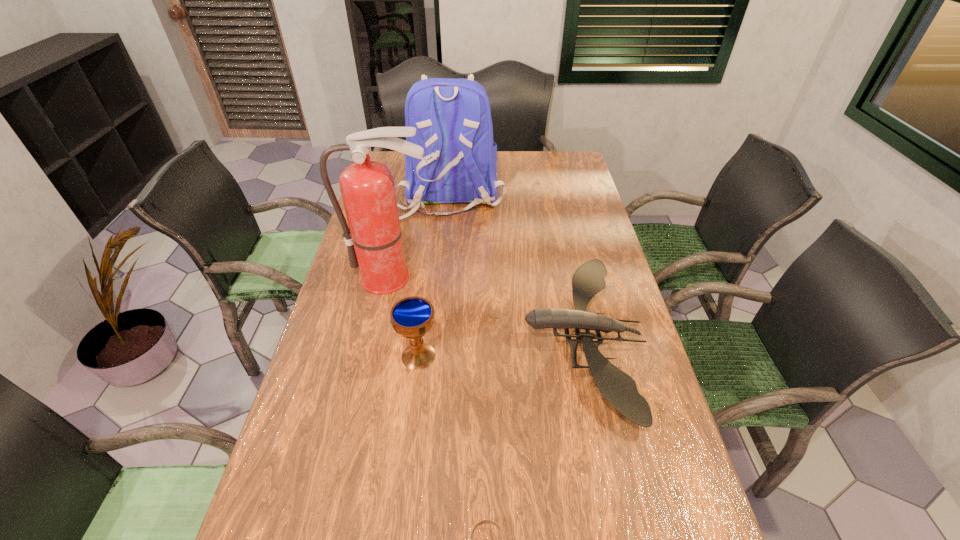
Image resolution: width=960 pixels, height=540 pixels. I want to click on vacant area between the backpack and the fire extinguisher, so click(421, 235).

The width and height of the screenshot is (960, 540). What are the coordinates of `empty location between the fire extinguisher and the drone` in the screenshot? It's located at point(487,308).

Locate an element on the screen. vacant space that's between the rightmost object and the fire extinguisher is located at coordinates (487, 308).

What are the coordinates of `free spot between the backpack and the fire extinguisher` in the screenshot? It's located at (421, 235).

Locate an element on the screen. This screenshot has width=960, height=540. unoccupied position between the third tallest object and the backpack is located at coordinates (434, 275).

The width and height of the screenshot is (960, 540). Identify the location of vacant area between the drone and the fire extinguisher. (487, 308).

Identify the location of empty space between the chalice and the farthest object. (434, 275).

Point out which object is positioned as the fourth nearest to the backpack. Please provide its 2D coordinates. Your answer should be formatted as a tuple, i.e. [(x, y)], where the tuple contains the x and y coordinates of a point satisfying the conditions above.

[(484, 521)]

Select which object appears as the third closest to the fire extinguisher. Please provide its 2D coordinates. Your answer should be formatted as a tuple, i.e. [(x, y)], where the tuple contains the x and y coordinates of a point satisfying the conditions above.

[(618, 388)]